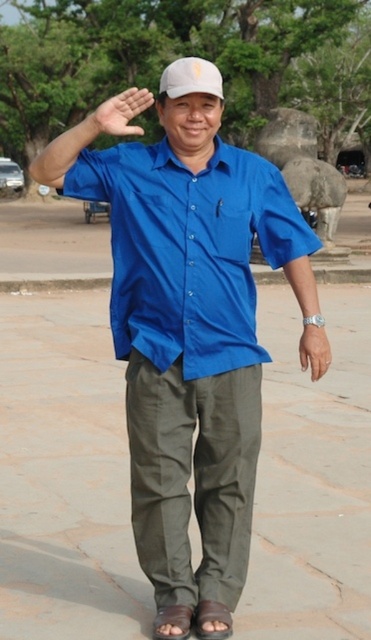
Is point (217, 385) closer to viewer compared to point (237, 589)?

Yes, point (217, 385) is closer to viewer.

Identify the location of blue cotton shirt at center. Image resolution: width=371 pixels, height=640 pixels. (188, 337).

Is olive green cotton pants at center taller than white matte baseball hat at center?

No.

Which is more to the left, olive green cotton pants at center or white matte baseball hat at center?

white matte baseball hat at center

Is point (168, 508) farther from viewer compared to point (185, 68)?

That is True.

Identify the location of olive green cotton pants at center. The image size is (371, 640). (194, 476).

Where is `olive green cotton pants at center`? olive green cotton pants at center is located at coordinates (194, 476).

Is olive green cotton pants at center wider than matte brown wristwatch at lower right?

Indeed, olive green cotton pants at center has a greater width compared to matte brown wristwatch at lower right.

Who is more forward, (211, 561) or (326, 355)?

Point (211, 561) is in front.

Locate an element on the screen. This screenshot has width=371, height=640. olive green cotton pants at center is located at coordinates (194, 476).